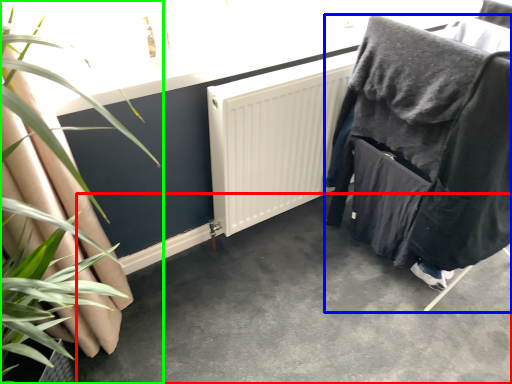
Question: Estimate the real-world distances between objects in this image. Which object is farther from concrete (highlighted by a red box), furniture (highlighted by a blue box) or houseplant (highlighted by a green box)?

Choices:
 (A) furniture
 (B) houseplant

Answer: (B)